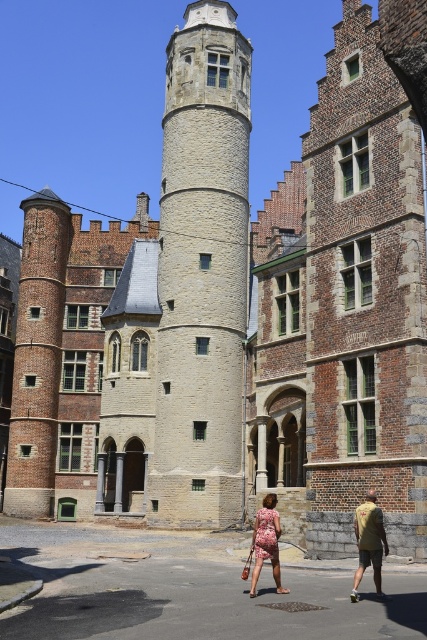
In the scene shown: You are standing in front of the historic building complex and see a khaki cotton shirt at lower right and a floral dress at center. Which clothing item is positioned more to the east?

The khaki cotton shirt at lower right is positioned more to the east because it is to the right of the floral dress at center, which is at the center of the image.

You are an artist standing in front of the historic building complex. You want to sketch the light gray stone tower at center and the floral dress at center. Which object should you focus on first to capture their spatial relationship accurately?

The light gray stone tower at center is further to the viewer than the floral dress at center, so you should focus on the light gray stone tower at center first to establish the foreground before moving to the background.

You are an architect visiting this historic site and notice the light gray stone tower at center and the khaki cotton shirt at lower right. Which object is taller?

The light gray stone tower at center is taller than the khaki cotton shirt at lower right.